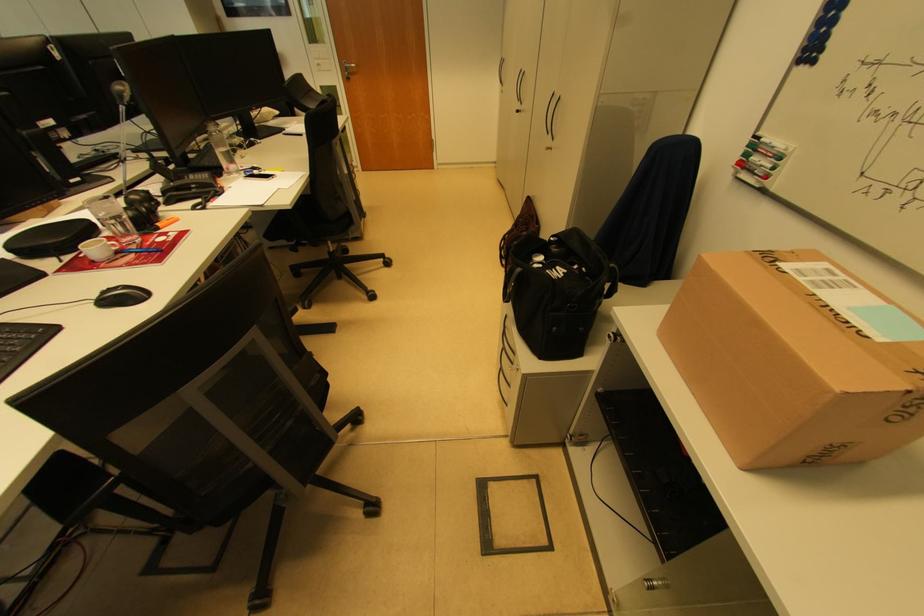
The height and width of the screenshot is (616, 924). What do you see at coordinates (760, 156) in the screenshot?
I see `the green whiteboard marker` at bounding box center [760, 156].